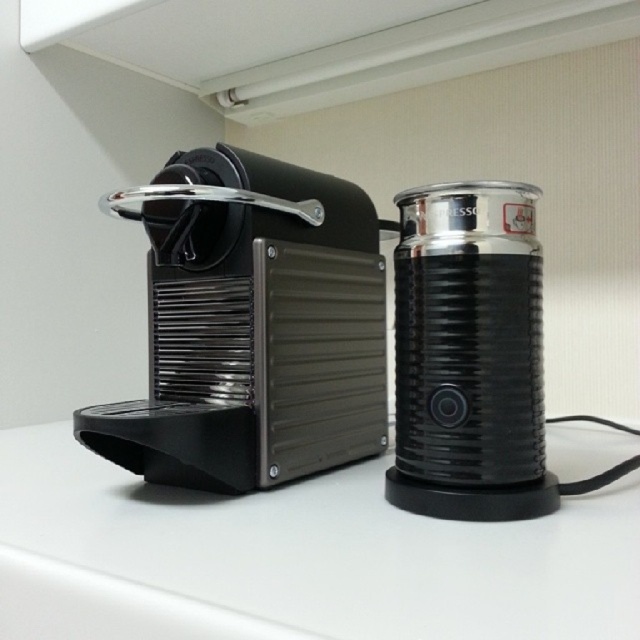
You are placing a 6 inch long decorative knife on the white matte counter at center. The matte black coffee machine at left is nearby. Will the knife fit entirely on the counter without touching the coffee machine?

The distance between the white matte counter at center and the matte black coffee machine at left is 6.29 inches. Since the knife is 6 inches long, it can fit entirely on the counter without touching the coffee machine as there is enough space.

You are standing in front of a kitchen counter with two appliances. You need to place a new spice jar between the matte black coffee machine at left and the cylindrical milk frother at right. The counter has a coordinate system where the bottom left corner is point 0,0 and the top right corner is point 1,1. The coffee machine is at point (252,326). Where should you place the spice jar so it is exactly halfway between them?

The spice jar should be placed at the midpoint between the matte black coffee machine at left and the cylindrical milk frother at right. Since the coffee machine is at point (252,326), and the frother is at an unknown coordinate, the exact halfway point requires knowing both positions. However, without the frother coordinates, we cannot calculate the exact midpoint. Please provide the frother coordinates for accurate placement.